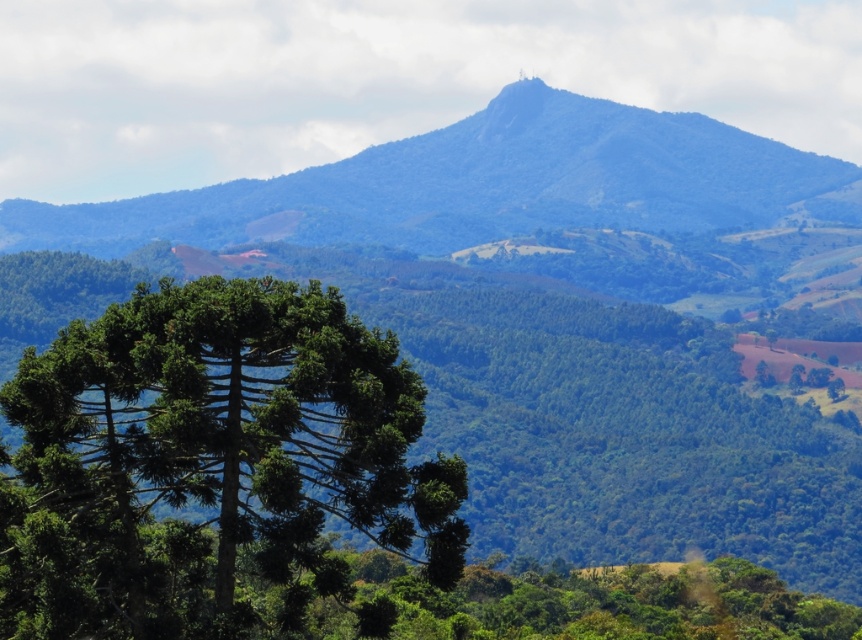
Based on the photo, you are a hiker standing at the base of the distinctive tree with a tiered structure. You see two points marked on your map. The first point is at coordinates point (95,547) and the second is at point (503,216). Which point is closer to your current position?

Point (95,547) is closer to the camera than point (503,216), so the first point is closer to your current position.